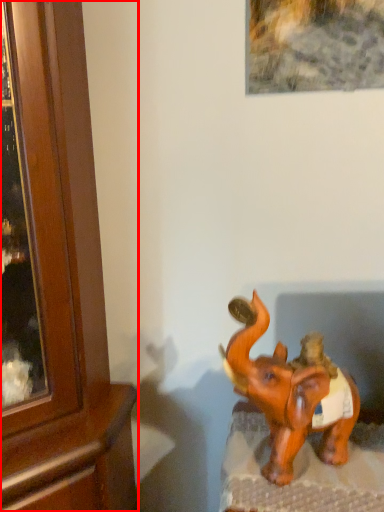
Question: From the image's perspective, what is the correct spatial positioning of cabinetry (annotated by the red box) in reference to elephant?

Choices:
 (A) below
 (B) above

Answer: (B)